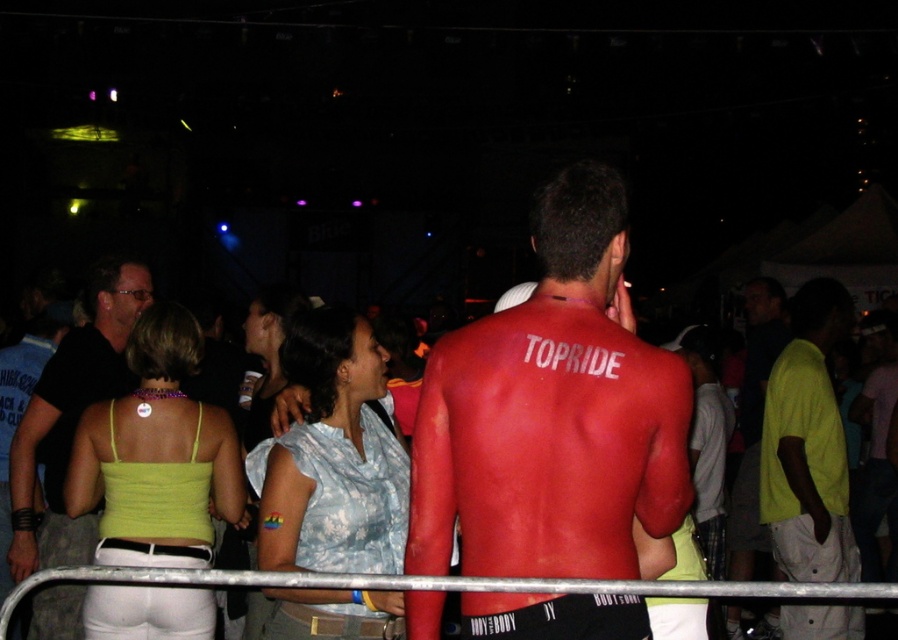
Image resolution: width=898 pixels, height=640 pixels. I want to click on matte black shirt at upper left, so click(x=71, y=417).

Between point (95, 352) and point (342, 586), which one is positioned behind?

Point (95, 352)

Identify the location of matte black shirt at upper left. The image size is (898, 640). (71, 417).

Which is more to the right, matte red body paint at center or matte black shirt at upper left?

matte red body paint at center

Between matte red body paint at center and matte black shirt at upper left, which one has more height?

With more height is matte black shirt at upper left.

Who is more distant from viewer, [632,346] or [89,344]?

Positioned behind is point [89,344].

You are a GUI agent. You are given a task and a screenshot of the screen. Output one action in this format:
    pyautogui.click(x=<x>, y=<y>)
    Task: Click on the matte red body paint at center
    
    Given the screenshot: What is the action you would take?
    pyautogui.click(x=552, y=413)

Is matte red body paint at center to the left of metal at lower center from the viewer's perspective?

Incorrect, matte red body paint at center is not on the left side of metal at lower center.

Describe the element at coordinates (552, 413) in the screenshot. I see `matte red body paint at center` at that location.

At what (x,y) coordinates should I click in order to perform the action: click on matte red body paint at center. Please return your answer as a coordinate pair (x, y). The height and width of the screenshot is (640, 898). Looking at the image, I should click on (x=552, y=413).